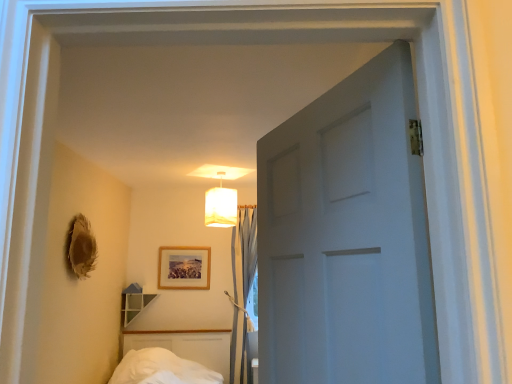
Find the location of a particular element. The width and height of the screenshot is (512, 384). wooden picture frame at center is located at coordinates (184, 268).

At what (x,y) coordinates should I click in order to perform the action: click on light blue fabric curtain at center. Please return your answer as a coordinate pair (x, y). The height and width of the screenshot is (384, 512). Looking at the image, I should click on (242, 280).

Is light blue fabric curtain at center in contact with wooden picture frame at center?

No, light blue fabric curtain at center is not beside wooden picture frame at center.

Considering the positions of point (241, 232) and point (184, 263), is point (241, 232) closer or farther from the camera than point (184, 263)?

Point (241, 232) appears to be farther away from the viewer than point (184, 263).

I want to click on picture frame lying above the light blue fabric curtain at center (from the image's perspective), so click(x=184, y=268).

Is wooden picture frame at center oriented towards light blue fabric curtain at center?

No, wooden picture frame at center is not aimed at light blue fabric curtain at center.

In the scene shown: From a real-world perspective, who is located lower, wooden picture frame at center or light blue fabric curtain at center?

In real-world perspective, light blue fabric curtain at center is lower.

Could light blue fabric curtain at center be considered to be inside wooden picture frame at center?

That's incorrect, light blue fabric curtain at center is not inside wooden picture frame at center.

You are a GUI agent. You are given a task and a screenshot of the screen. Output one action in this format:
    pyautogui.click(x=<x>, y=<y>)
    Task: Click on the picture frame lying on the left of light blue fabric curtain at center
    The image size is (512, 384).
    Given the screenshot: What is the action you would take?
    pyautogui.click(x=184, y=268)

This screenshot has height=384, width=512. In order to click on curtain behind the white fabric lampshade at upper center in this screenshot , I will do `click(242, 280)`.

What's the angular difference between light blue fabric curtain at center and white fabric lampshade at upper center's facing directions?

There is a 27.8-degree angle between the facing directions of light blue fabric curtain at center and white fabric lampshade at upper center.

Which of these two, light blue fabric curtain at center or white fabric lampshade at upper center, is smaller?

white fabric lampshade at upper center is smaller.

Could you tell me if light blue fabric curtain at center is turned towards white fabric lampshade at upper center?

Yes, light blue fabric curtain at center is facing white fabric lampshade at upper center.

You are a GUI agent. You are given a task and a screenshot of the screen. Output one action in this format:
    pyautogui.click(x=<x>, y=<y>)
    Task: Click on the picture frame behind the white fabric lampshade at upper center
    The image size is (512, 384).
    Given the screenshot: What is the action you would take?
    pyautogui.click(x=184, y=268)

From a real-world perspective, is wooden picture frame at center below white fabric lampshade at upper center?

Yes, from a real-world perspective, wooden picture frame at center is beneath white fabric lampshade at upper center.

Is wooden picture frame at center bigger or smaller than white fabric lampshade at upper center?

Clearly, wooden picture frame at center is smaller in size than white fabric lampshade at upper center.

Is wooden picture frame at center next to white fabric lampshade at upper center and touching it?

No.

Who is bigger, white fabric lampshade at upper center or wooden picture frame at center?

With larger size is white fabric lampshade at upper center.

Which object is more forward, white fabric lampshade at upper center or wooden picture frame at center?

white fabric lampshade at upper center is closer to the camera.

You are a GUI agent. You are given a task and a screenshot of the screen. Output one action in this format:
    pyautogui.click(x=<x>, y=<y>)
    Task: Click on the lamp lying in front of the wooden picture frame at center
    The image size is (512, 384).
    Given the screenshot: What is the action you would take?
    pyautogui.click(x=221, y=205)

Can you tell me how much white fabric lampshade at upper center and wooden picture frame at center differ in facing direction?

The facing directions of white fabric lampshade at upper center and wooden picture frame at center are 27.8 degrees apart.

How much distance is there between white fabric lampshade at upper center and light blue fabric curtain at center?

white fabric lampshade at upper center is 28.91 inches away from light blue fabric curtain at center.

Looking at this image, is white fabric lampshade at upper center taller than light blue fabric curtain at center?

No, white fabric lampshade at upper center is not taller than light blue fabric curtain at center.

Between point (216, 213) and point (243, 354), which one is positioned behind?

The point (243, 354) is farther from the camera.

From the image's perspective, is white fabric lampshade at upper center on light blue fabric curtain at center?

Yes.

You are a GUI agent. You are given a task and a screenshot of the screen. Output one action in this format:
    pyautogui.click(x=<x>, y=<y>)
    Task: Click on the picture frame on the left side of light blue fabric curtain at center
    
    Given the screenshot: What is the action you would take?
    pyautogui.click(x=184, y=268)

The width and height of the screenshot is (512, 384). Find the location of `curtain below the wooden picture frame at center (from the image's perspective)`. curtain below the wooden picture frame at center (from the image's perspective) is located at coordinates pos(242,280).

Estimate the real-world distances between objects in this image. Which object is further from wooden picture frame at center, white fabric lampshade at upper center or light blue fabric curtain at center?

white fabric lampshade at upper center is positioned further to the anchor wooden picture frame at center.

From the image, which object appears to be nearer to light blue fabric curtain at center, white fabric lampshade at upper center or wooden picture frame at center?

wooden picture frame at center lies closer to light blue fabric curtain at center than the other object.

From the picture: When comparing their distances from light blue fabric curtain at center, does wooden picture frame at center or white fabric lampshade at upper center seem further?

Based on the image, white fabric lampshade at upper center appears to be further to light blue fabric curtain at center.

Looking at the image, which one is located further to wooden picture frame at center, light blue fabric curtain at center or white fabric lampshade at upper center?

white fabric lampshade at upper center.

From the image, which object appears to be farther from white fabric lampshade at upper center, light blue fabric curtain at center or wooden picture frame at center?

Based on the image, wooden picture frame at center appears to be further to white fabric lampshade at upper center.

Estimate the real-world distances between objects in this image. Which object is closer to white fabric lampshade at upper center, wooden picture frame at center or light blue fabric curtain at center?

light blue fabric curtain at center lies closer to white fabric lampshade at upper center than the other object.

Locate an element on the screen. The height and width of the screenshot is (384, 512). picture frame between white fabric lampshade at upper center and light blue fabric curtain at center in the up-down direction is located at coordinates (184, 268).